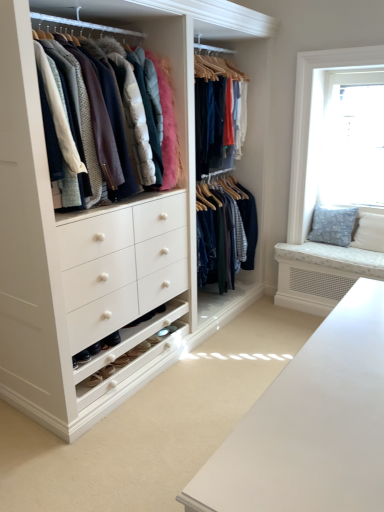
Question: Can you confirm if blue textured cushion at right is taller than transparent glass window at upper right?

Choices:
 (A) yes
 (B) no

Answer: (B)

Question: From a real-world perspective, is blue textured cushion at right over transparent glass window at upper right?

Choices:
 (A) no
 (B) yes

Answer: (A)

Question: Is blue textured cushion at right oriented away from transparent glass window at upper right?

Choices:
 (A) no
 (B) yes

Answer: (A)

Question: Is blue textured cushion at right to the left of transparent glass window at upper right from the viewer's perspective?

Choices:
 (A) no
 (B) yes

Answer: (B)

Question: Is blue textured cushion at right positioned in front of transparent glass window at upper right?

Choices:
 (A) yes
 (B) no

Answer: (B)

Question: Is transparent glass window at upper right situated inside matte white coat rack at upper left or outside?

Choices:
 (A) outside
 (B) inside

Answer: (A)

Question: Is transparent glass window at upper right in front of or behind matte white coat rack at upper left in the image?

Choices:
 (A) front
 (B) behind

Answer: (B)

Question: Is transparent glass window at upper right to the left or to the right of matte white coat rack at upper left in the image?

Choices:
 (A) right
 (B) left

Answer: (A)

Question: Considering the positions of transparent glass window at upper right and matte white coat rack at upper left in the image, is transparent glass window at upper right wider or thinner than matte white coat rack at upper left?

Choices:
 (A) wide
 (B) thin

Answer: (B)

Question: Considering the positions of point (331, 222) and point (319, 202), is point (331, 222) closer or farther from the camera than point (319, 202)?

Choices:
 (A) closer
 (B) farther

Answer: (A)

Question: In terms of size, does blue textured cushion at right appear bigger or smaller than transparent glass window at upper right?

Choices:
 (A) small
 (B) big

Answer: (A)

Question: From a real-world perspective, relative to transparent glass window at upper right, is blue textured cushion at right vertically above or below?

Choices:
 (A) below
 (B) above

Answer: (A)

Question: Do you think blue textured cushion at right is within transparent glass window at upper right, or outside of it?

Choices:
 (A) inside
 (B) outside

Answer: (B)

Question: Does point (105, 42) appear closer or farther from the camera than point (360, 179)?

Choices:
 (A) closer
 (B) farther

Answer: (A)

Question: From a real-world perspective, is matte white coat rack at upper left positioned above or below transparent glass window at upper right?

Choices:
 (A) above
 (B) below

Answer: (A)